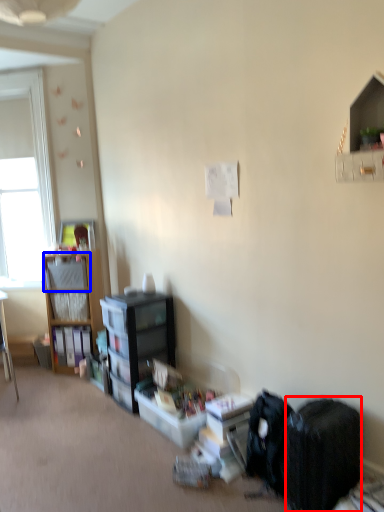
Question: Among these objects, which one is nearest to the camera, backpack (highlighted by a red box) or shelf (highlighted by a blue box)?

Choices:
 (A) backpack
 (B) shelf

Answer: (A)